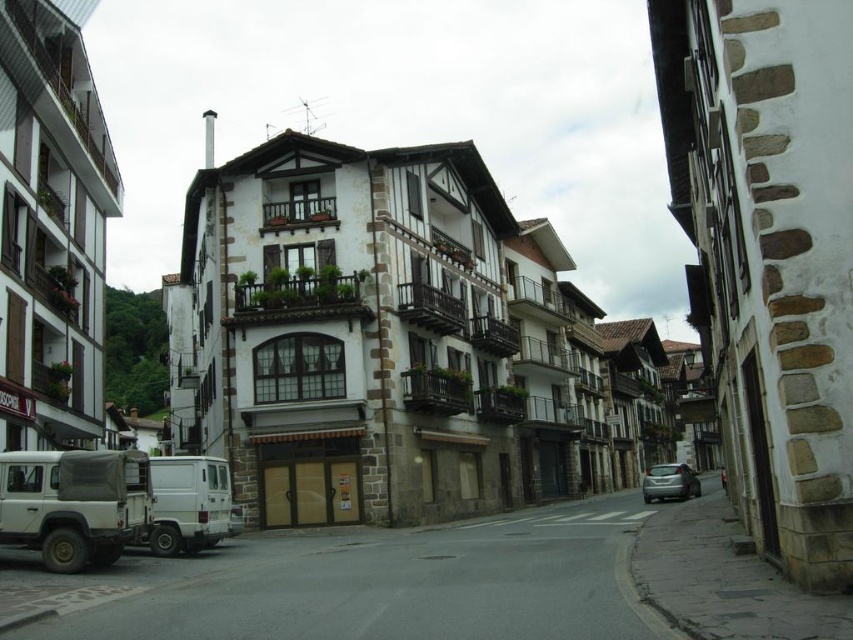
Question: Is matte white van at lower left above white matte van at lower left?

Choices:
 (A) no
 (B) yes

Answer: (B)

Question: Does white matte van at lower left have a greater width compared to satin silver car at lower right?

Choices:
 (A) no
 (B) yes

Answer: (A)

Question: Is matte white van at lower left to the left of white matte van at lower left from the viewer's perspective?

Choices:
 (A) yes
 (B) no

Answer: (A)

Question: Which object is closer to the camera taking this photo?

Choices:
 (A) matte white van at lower left
 (B) white matte van at lower left
 (C) satin silver car at lower right

Answer: (A)

Question: Estimate the real-world distances between objects in this image. Which object is farther from the satin silver car at lower right?

Choices:
 (A) white matte van at lower left
 (B) matte white van at lower left

Answer: (B)

Question: Which object appears closest to the camera in this image?

Choices:
 (A) satin silver car at lower right
 (B) white matte van at lower left

Answer: (B)